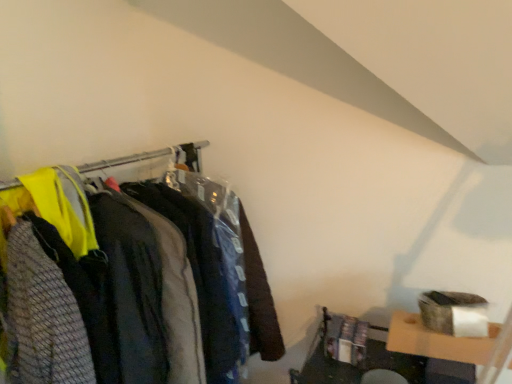
Question: Which direction should I rotate to look at dark gray fabric jacket at center, the second clothing in the front-to-back sequence, — up or down?

Choices:
 (A) up
 (B) down

Answer: (B)

Question: Considering the relative sizes of matte black clothing at left and textured gray sweater at left, the second clothing from the back, in the image provided, is matte black clothing at left bigger than textured gray sweater at left, the second clothing from the back,?

Choices:
 (A) yes
 (B) no

Answer: (A)

Question: Can you see matte black clothing at left touching textured gray sweater at left, which is counted as the first clothing, starting from the front?

Choices:
 (A) yes
 (B) no

Answer: (B)

Question: Is matte black clothing at left further to camera compared to textured gray sweater at left, which is counted as the first clothing, starting from the front?

Choices:
 (A) no
 (B) yes

Answer: (B)

Question: Can textured gray sweater at left, which is counted as the first clothing, starting from the front, be found inside matte black clothing at left?

Choices:
 (A) no
 (B) yes

Answer: (B)

Question: Is matte black clothing at left smaller than textured gray sweater at left, the second clothing from the back?

Choices:
 (A) yes
 (B) no

Answer: (B)

Question: Considering the relative positions of matte black clothing at left and textured gray sweater at left, the second clothing from the back, in the image provided, is matte black clothing at left to the left of textured gray sweater at left, the second clothing from the back, from the viewer's perspective?

Choices:
 (A) yes
 (B) no

Answer: (B)

Question: Does matte black clothing at left lie behind dark gray fabric jacket at center, which appears as the 1th clothing when viewed from the back?

Choices:
 (A) no
 (B) yes

Answer: (A)

Question: Is matte black clothing at left directly adjacent to dark gray fabric jacket at center, which appears as the 1th clothing when viewed from the back?

Choices:
 (A) no
 (B) yes

Answer: (A)

Question: Is matte black clothing at left in front of dark gray fabric jacket at center, which appears as the 1th clothing when viewed from the back?

Choices:
 (A) no
 (B) yes

Answer: (B)

Question: Is matte black clothing at left oriented towards dark gray fabric jacket at center, which appears as the 1th clothing when viewed from the back?

Choices:
 (A) yes
 (B) no

Answer: (A)

Question: From the image's perspective, would you say matte black clothing at left is positioned over dark gray fabric jacket at center, which appears as the 1th clothing when viewed from the back?

Choices:
 (A) yes
 (B) no

Answer: (B)

Question: From a real-world perspective, is matte black clothing at left located beneath dark gray fabric jacket at center, which appears as the 1th clothing when viewed from the back?

Choices:
 (A) yes
 (B) no

Answer: (A)

Question: From a real-world perspective, is textured gray sweater at left, which is counted as the first clothing, starting from the front, located higher than dark gray fabric jacket at center, which appears as the 1th clothing when viewed from the back?

Choices:
 (A) yes
 (B) no

Answer: (A)